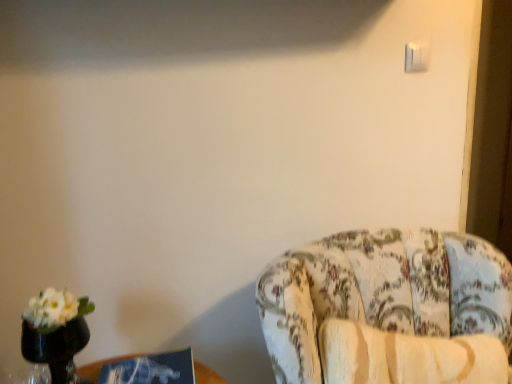
Image resolution: width=512 pixels, height=384 pixels. I want to click on vacant area on top of blue cardboard box at lower left (from a real-world perspective), so click(158, 365).